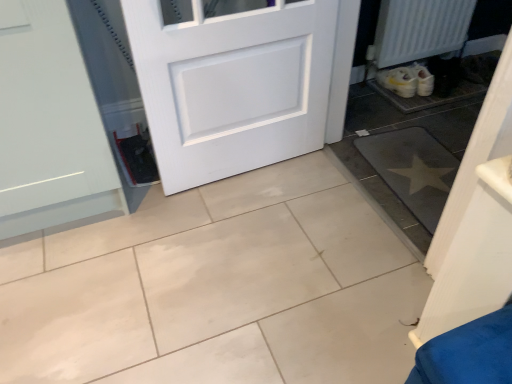
Identify the location of free space below white matte door at center (from a real-world perspective). (239, 170).